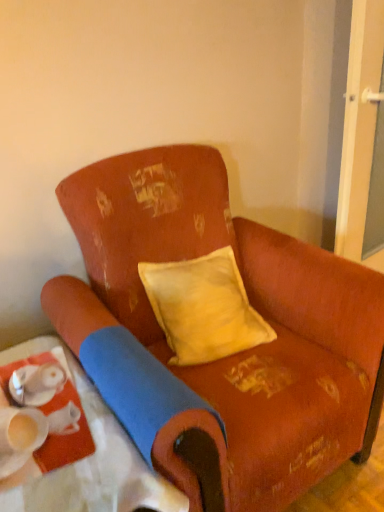
Question: Is matte white tray at lower left smaller than worn fabric chair at center?

Choices:
 (A) no
 (B) yes

Answer: (B)

Question: Is matte white tray at lower left completely or partially outside of worn fabric chair at center?

Choices:
 (A) no
 (B) yes

Answer: (B)

Question: Is matte white tray at lower left oriented towards worn fabric chair at center?

Choices:
 (A) no
 (B) yes

Answer: (A)

Question: Are matte white tray at lower left and worn fabric chair at center beside each other?

Choices:
 (A) yes
 (B) no

Answer: (B)

Question: Considering the relative sizes of matte white tray at lower left and worn fabric chair at center in the image provided, is matte white tray at lower left bigger than worn fabric chair at center?

Choices:
 (A) no
 (B) yes

Answer: (A)

Question: Is matte white tray at lower left taller or shorter than transparent glass screen door at right?

Choices:
 (A) short
 (B) tall

Answer: (A)

Question: From a real-world perspective, relative to transparent glass screen door at right, is matte white tray at lower left vertically above or below?

Choices:
 (A) above
 (B) below

Answer: (B)

Question: Relative to transparent glass screen door at right, is matte white tray at lower left in front or behind?

Choices:
 (A) front
 (B) behind

Answer: (A)

Question: Is matte white tray at lower left inside the boundaries of transparent glass screen door at right, or outside?

Choices:
 (A) outside
 (B) inside

Answer: (A)

Question: In terms of size, does yellow velvet pillow at center appear bigger or smaller than transparent glass screen door at right?

Choices:
 (A) big
 (B) small

Answer: (B)

Question: Is yellow velvet pillow at center in front of or behind transparent glass screen door at right in the image?

Choices:
 (A) behind
 (B) front

Answer: (B)

Question: Is yellow velvet pillow at center to the left or to the right of transparent glass screen door at right in the image?

Choices:
 (A) left
 (B) right

Answer: (A)

Question: From their relative heights in the image, would you say yellow velvet pillow at center is taller or shorter than transparent glass screen door at right?

Choices:
 (A) tall
 (B) short

Answer: (B)

Question: In the image, is yellow velvet pillow at center on the left side or the right side of matte white tray at lower left?

Choices:
 (A) right
 (B) left

Answer: (A)

Question: Is yellow velvet pillow at center situated inside matte white tray at lower left or outside?

Choices:
 (A) inside
 (B) outside

Answer: (B)